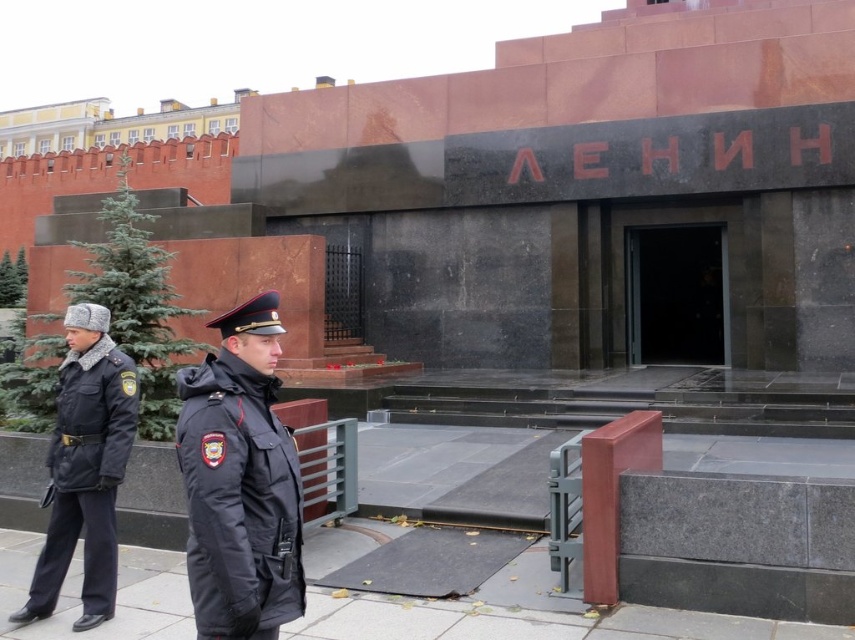
Which is in front, point (246, 440) or point (693, 264)?

Positioned in front is point (246, 440).

Based on the photo, is dark blue fabric uniform at left smaller than black glass door at center?

Indeed, dark blue fabric uniform at left has a smaller size compared to black glass door at center.

What do you see at coordinates (239, 500) in the screenshot? The width and height of the screenshot is (855, 640). I see `dark blue fabric uniform at left` at bounding box center [239, 500].

The height and width of the screenshot is (640, 855). Find the location of `dark blue fabric uniform at left`. dark blue fabric uniform at left is located at coordinates (239, 500).

Which of these two, dark blue fabric uniform at left or black matte uniform at left, stands shorter?

dark blue fabric uniform at left

Does dark blue fabric uniform at left have a larger size compared to black matte uniform at left?

Actually, dark blue fabric uniform at left might be smaller than black matte uniform at left.

The width and height of the screenshot is (855, 640). Describe the element at coordinates (239, 500) in the screenshot. I see `dark blue fabric uniform at left` at that location.

The height and width of the screenshot is (640, 855). I want to click on dark blue fabric uniform at left, so click(x=239, y=500).

Is point (51, 500) positioned behind point (663, 257)?

No, it is not.

Measure the distance between black matte uniform at left and black glass door at center.

They are 36.27 feet apart.

This screenshot has height=640, width=855. I want to click on black matte uniform at left, so click(x=86, y=474).